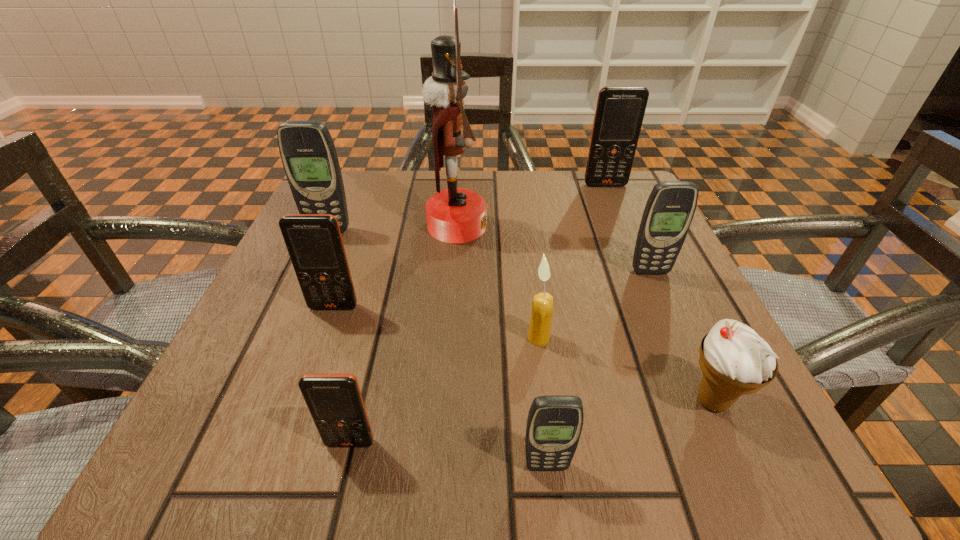
You are a GUI agent. You are given a task and a screenshot of the screen. Output one action in this format:
    pyautogui.click(x=<x>, y=<y>)
    Task: Click on the cellular telephone that is the third closest to the second farthest orange cellular telephone
    
    Given the screenshot: What is the action you would take?
    point(554,424)

This screenshot has height=540, width=960. Identify the location of cellular telephone that is the second closest to the third cellular telephone from left to right. (314, 242).

Find the location of a particular element. The width and height of the screenshot is (960, 540). orange cellular telephone that is the closest to the biggest gray cellular telephone is located at coordinates (314, 242).

What are the coordinates of `orange cellular telephone object that ranks as the third closest to the icecream` in the screenshot? It's located at (620, 110).

Locate which gray cellular telephone is the second closest to the farthest object. Please provide its 2D coordinates. Your answer should be formatted as a tuple, i.e. [(x, y)], where the tuple contains the x and y coordinates of a point satisfying the conditions above.

[(308, 154)]

Identify the location of gray cellular telephone that is the second closest to the tallest object. (670, 208).

The image size is (960, 540). I want to click on vacant region that satisfies the following two spatial constraints: 1. on the screen of the white icecream; 2. on the left side of the third farthest cellular telephone, so click(708, 401).

This screenshot has width=960, height=540. What are the coordinates of `free region that satisfies the following two spatial constraints: 1. on the front-facing side of the nutcracker; 2. on the screen of the farthest gray cellular telephone` in the screenshot? It's located at (457, 231).

Where is `vacant space that satisfies the following two spatial constraints: 1. on the screen of the farthest gray cellular telephone; 2. on the left side of the fourth nearest object`? The width and height of the screenshot is (960, 540). vacant space that satisfies the following two spatial constraints: 1. on the screen of the farthest gray cellular telephone; 2. on the left side of the fourth nearest object is located at coordinates click(x=281, y=338).

Locate an element on the screen. vacant area that satisfies the following two spatial constraints: 1. on the screen of the second biggest orange cellular telephone; 2. on the left side of the cream candle is located at coordinates (323, 338).